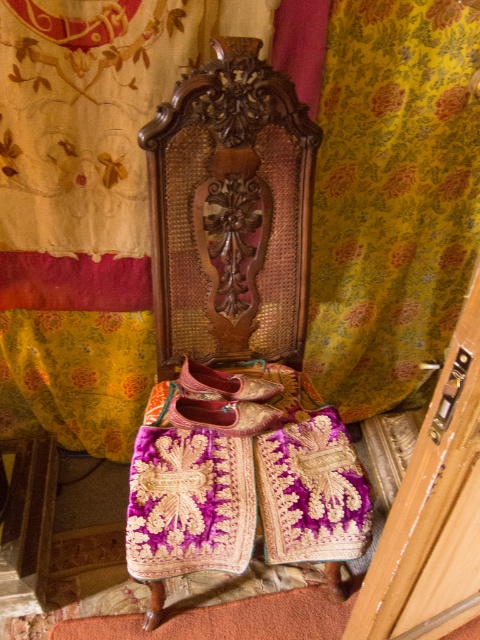
Question: Among these points, which one is farthest from the camera?

Choices:
 (A) (304, 200)
 (B) (257, 410)
 (C) (457, 157)
 (D) (260, 396)

Answer: (C)

Question: Is dark wood carved headboard at center to the left of purple velvet shoe at center from the viewer's perspective?

Choices:
 (A) yes
 (B) no

Answer: (B)

Question: Does purple velvet shoe at center have a greater width compared to leather/embossed shoe at center?

Choices:
 (A) no
 (B) yes

Answer: (A)

Question: Which object is positioned closest to the leather/embossed shoe at center?

Choices:
 (A) dark wood carved headboard at center
 (B) purple velvet shoe at center
 (C) yellow floral fabric at upper center

Answer: (B)

Question: Estimate the real-world distances between objects in this image. Which object is farther from the dark wood carved headboard at center?

Choices:
 (A) leather/embossed shoe at center
 (B) purple velvet shoe at center
 (C) yellow floral fabric at upper center

Answer: (B)

Question: Can you confirm if yellow floral fabric at upper center is positioned above dark wood carved headboard at center?

Choices:
 (A) yes
 (B) no

Answer: (B)